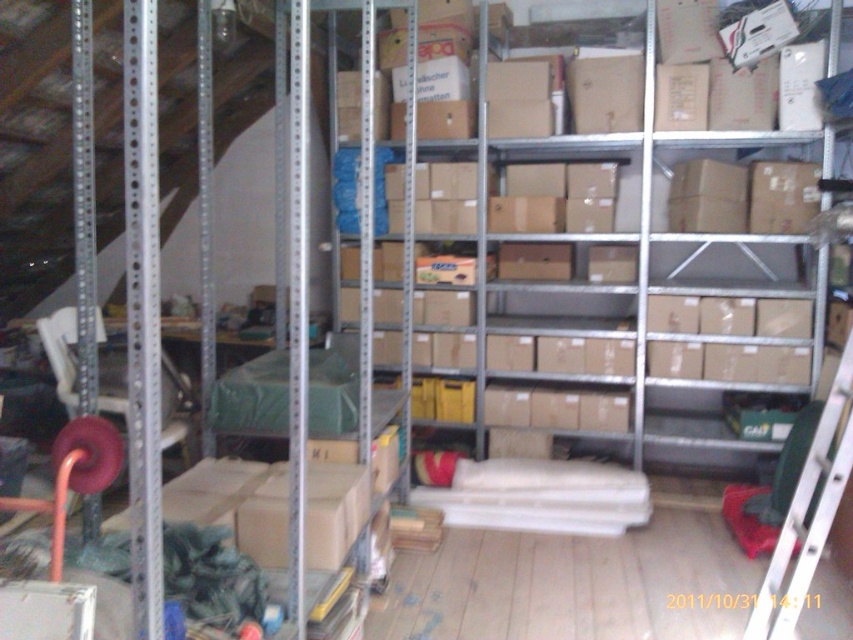
Question: Is brown cardboard boxes at center further to the viewer compared to silver metallic ladder at lower right?

Choices:
 (A) no
 (B) yes

Answer: (B)

Question: Does brown cardboard boxes at center have a greater width compared to silver metallic ladder at lower right?

Choices:
 (A) yes
 (B) no

Answer: (A)

Question: Can you confirm if brown cardboard boxes at center is positioned to the left of silver metallic ladder at lower right?

Choices:
 (A) no
 (B) yes

Answer: (B)

Question: Which of the following is the farthest from the observer?

Choices:
 (A) (526, 349)
 (B) (846, 385)

Answer: (A)